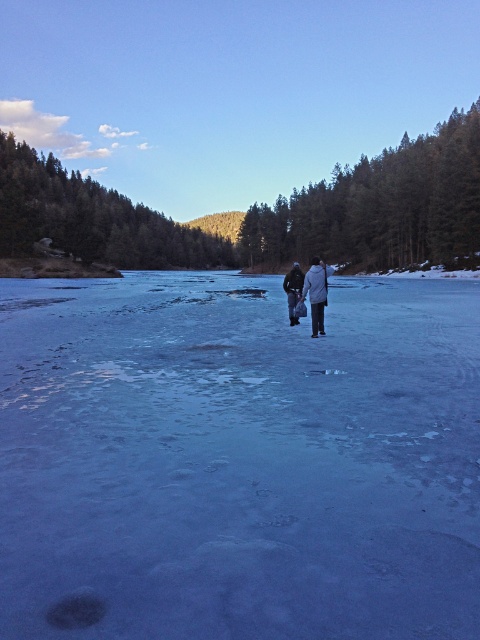
Which is behind, point (172, 605) or point (323, 262)?

Point (323, 262)

Is blue ice at center closer to the viewer compared to white woolen coat at center?

Yes, blue ice at center is closer to the viewer.

Who is more forward, (398, 321) or (316, 321)?

Positioned in front is point (316, 321).

Locate an element on the screen. The width and height of the screenshot is (480, 640). blue ice at center is located at coordinates (238, 460).

Does point (101, 536) come closer to viewer compared to point (299, 269)?

Yes, point (101, 536) is in front of point (299, 269).

Locate an element on the screen. blue ice at center is located at coordinates (238, 460).

This screenshot has height=640, width=480. What do you see at coordinates (316, 291) in the screenshot?
I see `white woolen coat at center` at bounding box center [316, 291].

Between point (317, 284) and point (294, 317), which one is positioned in front?

Point (317, 284) is in front.

Which is in front, point (325, 291) or point (288, 291)?

Point (325, 291) is more forward.

You are a GUI agent. You are given a task and a screenshot of the screen. Output one action in this format:
    pyautogui.click(x=<x>, y=<y>)
    Task: Click on the white woolen coat at center
    
    Given the screenshot: What is the action you would take?
    pyautogui.click(x=316, y=291)